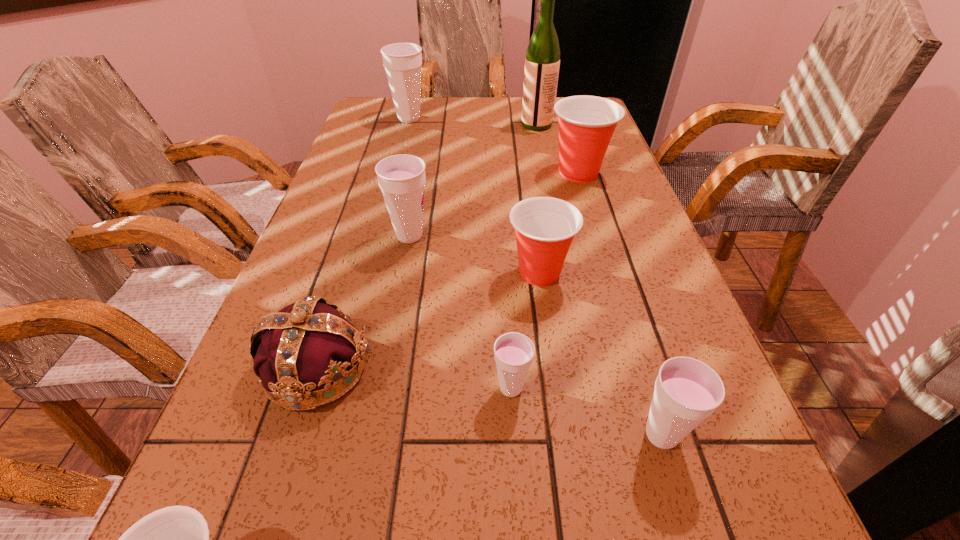
Where is `free space located 0.120m on the front of the second biggest purple cup`? The width and height of the screenshot is (960, 540). free space located 0.120m on the front of the second biggest purple cup is located at coordinates pos(400,288).

Where is `vacant space located on the right of the purple crown`? The width and height of the screenshot is (960, 540). vacant space located on the right of the purple crown is located at coordinates (601, 367).

Identify the location of free spot located on the left of the rightmost purple cup. (595, 435).

Find the location of a particular element. Image resolution: width=960 pixels, height=540 pixels. vacant space situated on the back of the second biggest red cup is located at coordinates (529, 195).

The image size is (960, 540). Identify the location of vacant space located 0.310m on the right of the fifth farthest cup. (717, 388).

Where is `liquor at the far edge`? Image resolution: width=960 pixels, height=540 pixels. liquor at the far edge is located at coordinates (542, 62).

The width and height of the screenshot is (960, 540). I want to click on cup present at the far edge, so click(402, 61).

Locate an element on the screen. Image resolution: width=960 pixels, height=540 pixels. cup that is at the left edge is located at coordinates (402, 61).

Where is `crown positioned at the left edge`? The height and width of the screenshot is (540, 960). crown positioned at the left edge is located at coordinates (308, 344).

Image resolution: width=960 pixels, height=540 pixels. What are the coordinates of `object at the far left corner` in the screenshot? It's located at (402, 61).